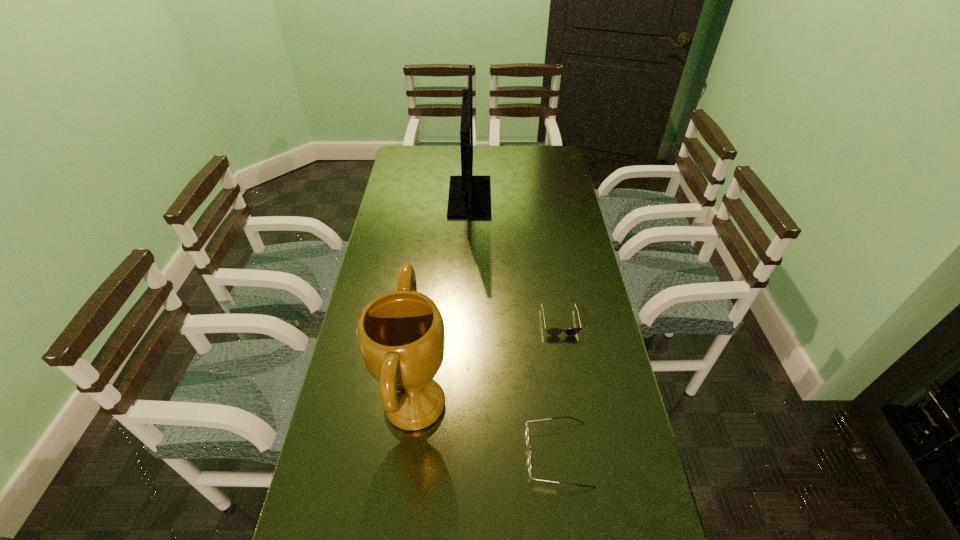
Where is `monitor`? The image size is (960, 540). monitor is located at coordinates (469, 197).

Find the location of a particular element. This screenshot has height=540, width=960. the farthest object is located at coordinates (469, 197).

Find the location of a particular element. Image resolution: width=960 pixels, height=540 pixels. award is located at coordinates (401, 335).

Find the location of a particular element. spectacles is located at coordinates (527, 433).

Identify the location of sunglasses. This screenshot has width=960, height=540. (551, 331).

The height and width of the screenshot is (540, 960). I want to click on the third nearest object, so click(551, 331).

Locate an element on the screen. The width and height of the screenshot is (960, 540). free location located 0.120m on the screen side of the farthest object is located at coordinates (519, 197).

The height and width of the screenshot is (540, 960). I want to click on vacant region located 0.230m on the front of the award with the decoration, so click(x=538, y=404).

The width and height of the screenshot is (960, 540). Find the location of `blank space located 0.210m through the lenses of the spectacles`. blank space located 0.210m through the lenses of the spectacles is located at coordinates (440, 454).

Where is `free space located through the lenses of the spectacles`? free space located through the lenses of the spectacles is located at coordinates (448, 454).